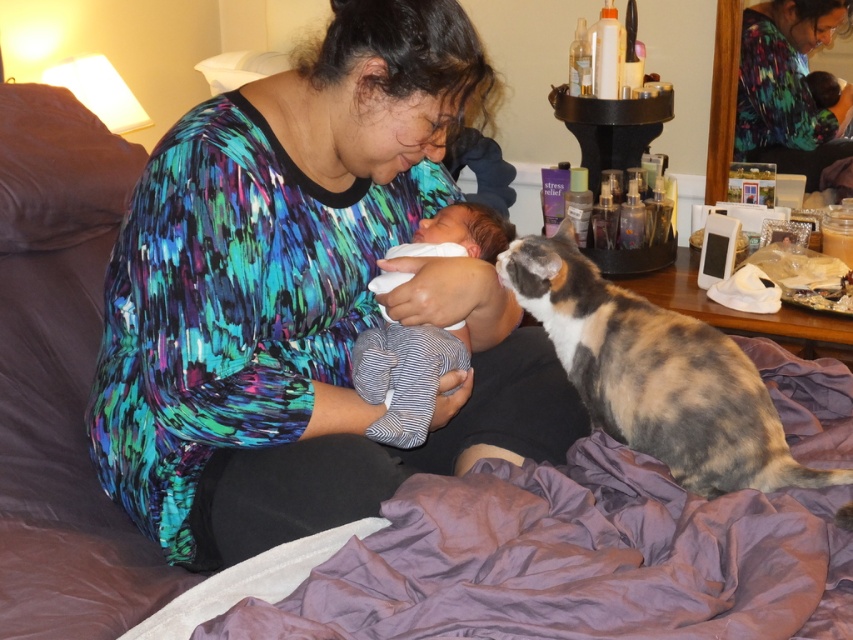
You are a delivery robot that is 0.8 meters wide. You need to deliver a gift to the woman holding the baby. The only path available is between the calico fur cat at right and the edge of the bed. Can you fit through this path?

The distance between the calico fur cat at right and the viewer is 1.03 meters. Since the robot is 0.8 meters wide, it can fit through the path as 1.03 meters is wider than the robot.

You are a photographer setting up for a family photo. You need to place two markers at the coordinates point (392, 182) and point (720, 429). Which marker should be placed closer to the camera?

Point (392, 182) is further to the viewer than point (720, 429), so the marker at point (392, 182) should be placed closer to the camera.

You are a photographer setting up a photo shoot in this scene. You want to ensure the purple satin blanket at lower center and the white soft baby at center are both visible in the shot. Based on their positions, which object is closer to the camera?

The purple satin blanket at lower center is in front of the white soft baby at center, so it is closer to the camera.